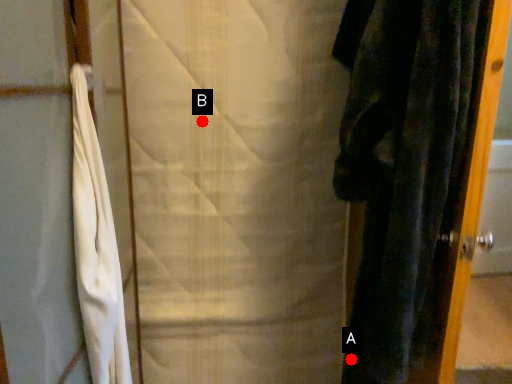
Question: Two points are circled on the image, labeled by A and B beside each circle. Which point is further to the camera?

Choices:
 (A) A is further
 (B) B is further

Answer: (B)